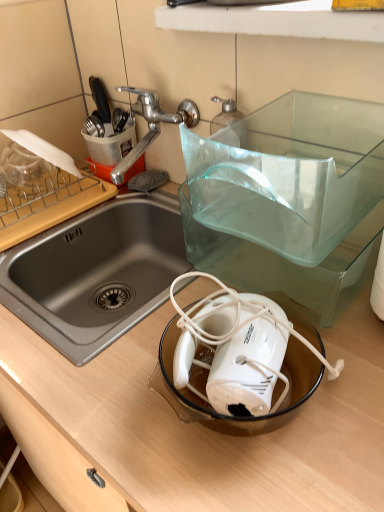
Identify the location of free spot above wooden counter at center (from a real-world perspective). (197, 288).